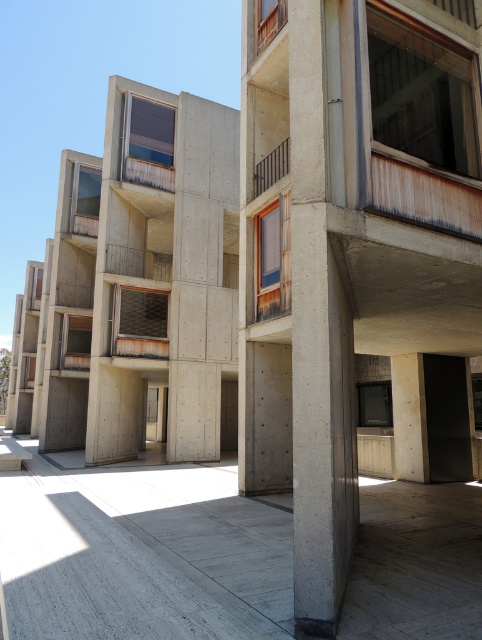
You are standing 3 meters away from the gray concrete at center. Can you reach it without moving closer?

The gray concrete at center is 3.87 meters away from the camera, so you are currently 3 meters away. Since 3 meters is less than 3.87 meters, you are closer than the required distance. Therefore, you can reach the gray concrete at center without needing to move closer.

You are an architect evaluating the structural integrity of the building. You notice the gray concrete at center and the rustic metal balcony at upper center. Based on their positions, which object is more likely to be exposed to rainwater runoff from the balcony above?

The gray concrete at center is located below the rustic metal balcony at upper center, so it is more likely to be exposed to rainwater runoff from the balcony above.